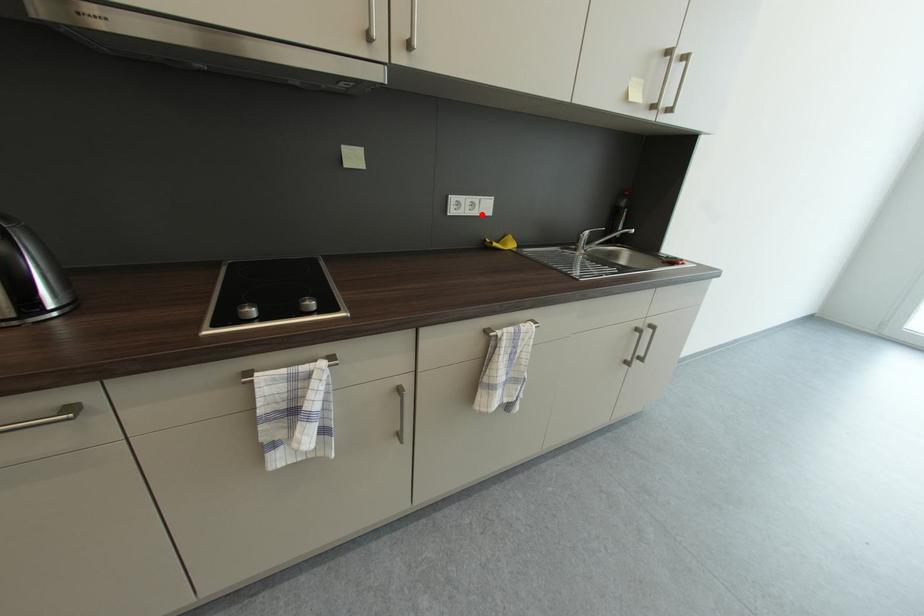
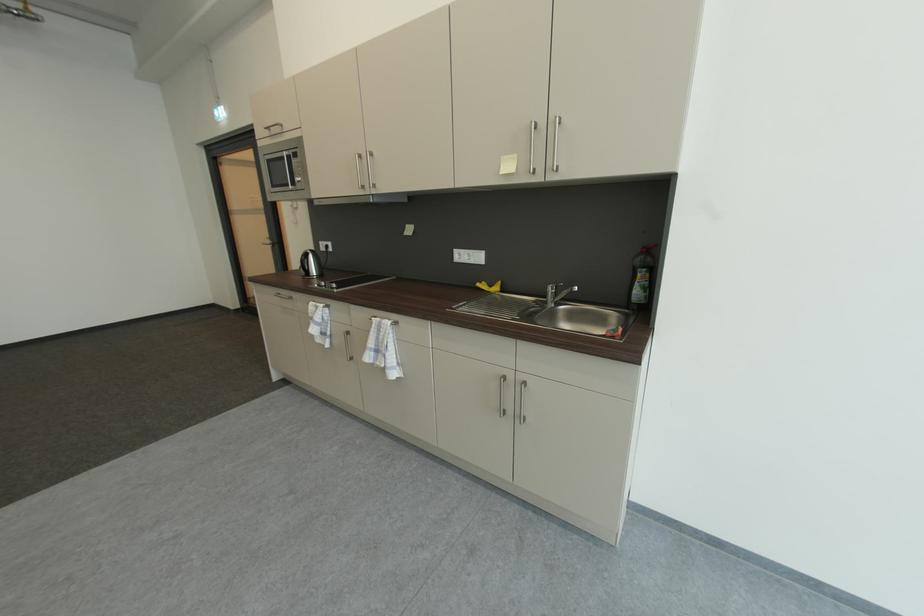
Question: I am providing you with two images of the same scene from different viewpoints. A red point is shown in image1. For the corresponding object point in image2, is it positioned nearer or farther from the camera?

Choices:
 (A) Nearer
 (B) Farther

Answer: (B)